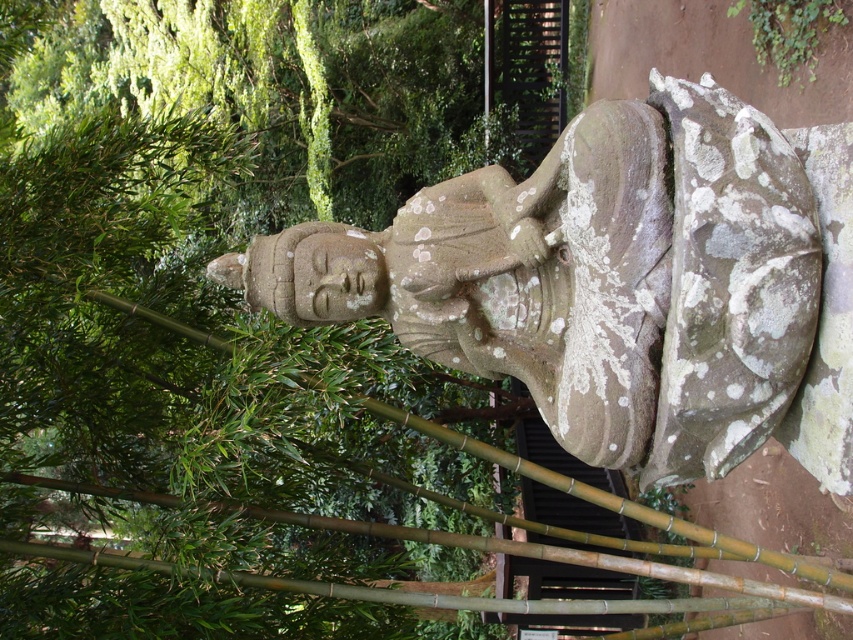
You are standing in front of the stone statue and notice two points marked on the image. The first point is at coordinates point (15, 355) and the second is at point (819, 16). Which point is closer to you?

Point (15, 355) is closer to the viewer than point (819, 16).

Looking at this image, you are a gardener planning to trim the green bamboo at center and the stone statue at center. Which object requires a ladder to reach its top?

The stone statue at center is taller than the green bamboo at center, so you would need a ladder to reach the top of the stone statue at center.

You are standing in the serene outdoor scene with the stone statue of a seated figure. You notice a specific point at coordinates (x=151, y=268). What object is located at this point?

The green bamboo at center is located at point (x=151, y=268).